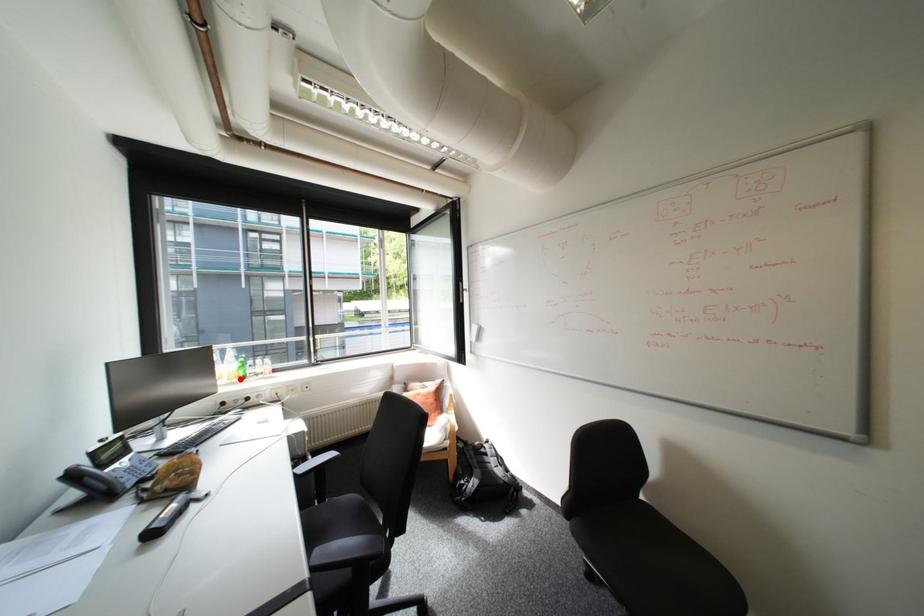
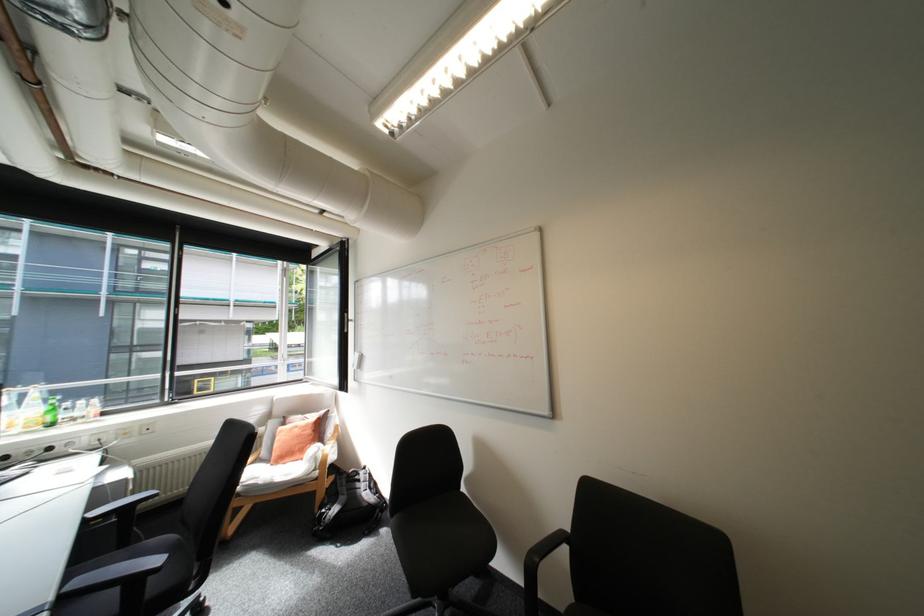
The point at the highlighted location is marked in the first image. Where is the corresponding point in the second image?

(38, 427)